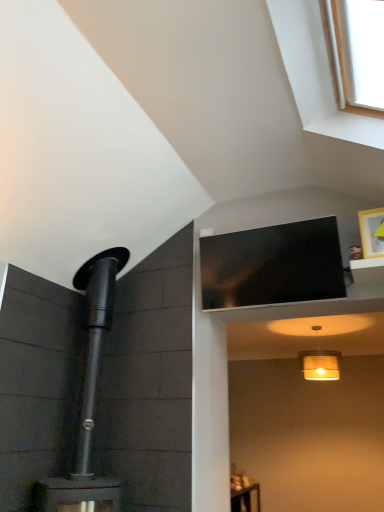
What do you see at coordinates (371, 232) in the screenshot?
I see `wooden picture frame at upper right` at bounding box center [371, 232].

This screenshot has width=384, height=512. In order to click on black glossy tv at upper center in this screenshot , I will do [x=272, y=265].

Locate an element on the screen. matte white lampshade at lower center is located at coordinates (320, 364).

Describe the element at coordinates (320, 364) in the screenshot. I see `matte white lampshade at lower center` at that location.

At what (x,y) coordinates should I click in order to perform the action: click on wooden picture frame at upper right. Please return your answer as a coordinate pair (x, y). The width and height of the screenshot is (384, 512). Looking at the image, I should click on tap(371, 232).

Locate an element on the screen. window located in front of the matte white lampshade at lower center is located at coordinates (317, 74).

Which of these two, matte white lampshade at lower center or white wood window at upper right, stands taller?

Standing taller between the two is white wood window at upper right.

From the image's perspective, which is above, matte white lampshade at lower center or white wood window at upper right?

white wood window at upper right, from the image's perspective.

Looking at their sizes, would you say matte white lampshade at lower center is wider or thinner than white wood window at upper right?

Considering their sizes, matte white lampshade at lower center looks slimmer than white wood window at upper right.

How far apart are black glossy tv at upper center and matte white lampshade at lower center?

black glossy tv at upper center and matte white lampshade at lower center are 1.66 meters apart from each other.

Looking at this image, is black glossy tv at upper center not near matte white lampshade at lower center?

Absolutely, black glossy tv at upper center is distant from matte white lampshade at lower center.

Considering the points (286, 287) and (298, 353), which point is in front, point (286, 287) or point (298, 353)?

The point (286, 287) is in front.

Is black glossy tv at upper center wider than matte white lampshade at lower center?

In fact, black glossy tv at upper center might be narrower than matte white lampshade at lower center.

Considering the positions of point (363, 245) and point (364, 124), is point (363, 245) closer or farther from the camera than point (364, 124)?

Point (363, 245).

Does wooden picture frame at upper right have a lesser height compared to white wood window at upper right?

Correct, wooden picture frame at upper right is not as tall as white wood window at upper right.

Is wooden picture frame at upper right directly adjacent to white wood window at upper right?

No, wooden picture frame at upper right is not making contact with white wood window at upper right.

From a real-world perspective, is wooden picture frame at upper right beneath white wood window at upper right?

Yes, from a real-world perspective, wooden picture frame at upper right is beneath white wood window at upper right.

Measure the distance from black glossy tv at upper center to wooden picture frame at upper right.

A distance of 20.78 inches exists between black glossy tv at upper center and wooden picture frame at upper right.

Between black glossy tv at upper center and wooden picture frame at upper right, which one has larger width?

black glossy tv at upper center is wider.

From the image's perspective, which one is positioned higher, black glossy tv at upper center or wooden picture frame at upper right?

wooden picture frame at upper right, from the image's perspective.

From the picture: Considering the relative sizes of black glossy tv at upper center and wooden picture frame at upper right in the image provided, is black glossy tv at upper center taller than wooden picture frame at upper right?

Yes, black glossy tv at upper center is taller than wooden picture frame at upper right.

Which is behind, matte white lampshade at lower center or black glossy tv at upper center?

matte white lampshade at lower center is more distant.

From the image's perspective, is matte white lampshade at lower center below black glossy tv at upper center?

Yes.

Looking at this image, in terms of width, does matte white lampshade at lower center look wider or thinner when compared to black glossy tv at upper center?

In the image, matte white lampshade at lower center appears to be wider than black glossy tv at upper center.

Considering the sizes of objects matte white lampshade at lower center and black glossy tv at upper center in the image provided, who is smaller, matte white lampshade at lower center or black glossy tv at upper center?

With smaller size is matte white lampshade at lower center.

You are a GUI agent. You are given a task and a screenshot of the screen. Output one action in this format:
    pyautogui.click(x=<x>, y=<y>)
    Task: Click on the window screen that appears below the white wood window at upper right (from the image's perspective)
    This screenshot has height=512, width=384.
    Given the screenshot: What is the action you would take?
    pyautogui.click(x=272, y=265)

Would you say white wood window at upper right is part of black glossy tv at upper center's contents?

No, white wood window at upper right is not surrounded by black glossy tv at upper center.

From the image's perspective, would you say black glossy tv at upper center is shown under white wood window at upper right?

Correct, black glossy tv at upper center appears lower than white wood window at upper right in the image.

Does black glossy tv at upper center have a greater height compared to white wood window at upper right?

No.

This screenshot has width=384, height=512. I want to click on picture frame lying in front of the matte white lampshade at lower center, so click(x=371, y=232).

From the image's perspective, is wooden picture frame at upper right located above or below matte white lampshade at lower center?

From the image's perspective, wooden picture frame at upper right appears above matte white lampshade at lower center.

How many degrees apart are the facing directions of wooden picture frame at upper right and matte white lampshade at lower center?

13.1 degrees separate the facing orientations of wooden picture frame at upper right and matte white lampshade at lower center.

Considering the relative sizes of wooden picture frame at upper right and matte white lampshade at lower center in the image provided, is wooden picture frame at upper right wider than matte white lampshade at lower center?

No, wooden picture frame at upper right is not wider than matte white lampshade at lower center.

Locate an element on the screen. The width and height of the screenshot is (384, 512). light fixture below the white wood window at upper right (from a real-world perspective) is located at coordinates (320, 364).

At what (x,y) coordinates should I click in order to perform the action: click on light fixture below the black glossy tv at upper center (from the image's perspective). Please return your answer as a coordinate pair (x, y). The height and width of the screenshot is (512, 384). Looking at the image, I should click on (320, 364).

Based on the photo, looking at the image, which one is located further to white wood window at upper right, matte white lampshade at lower center or black glossy tv at upper center?

Among the two, matte white lampshade at lower center is located further to white wood window at upper right.

Estimate the real-world distances between objects in this image. Which object is closer to wooden picture frame at upper right, white wood window at upper right or matte white lampshade at lower center?

The object closer to wooden picture frame at upper right is white wood window at upper right.

Looking at the image, which one is located further to wooden picture frame at upper right, white wood window at upper right or black glossy tv at upper center?

white wood window at upper right is further to wooden picture frame at upper right.

Which object lies further to the anchor point black glossy tv at upper center, wooden picture frame at upper right or white wood window at upper right?

white wood window at upper right is further to black glossy tv at upper center.

Looking at the image, which one is located further to black glossy tv at upper center, matte white lampshade at lower center or wooden picture frame at upper right?

Based on the image, matte white lampshade at lower center appears to be further to black glossy tv at upper center.

Based on their spatial positions, is white wood window at upper right or wooden picture frame at upper right further from black glossy tv at upper center?

white wood window at upper right is positioned further to the anchor black glossy tv at upper center.

Based on their spatial positions, is black glossy tv at upper center or wooden picture frame at upper right closer to white wood window at upper right?

wooden picture frame at upper right is positioned closer to the anchor white wood window at upper right.

When comparing their distances from matte white lampshade at lower center, does white wood window at upper right or black glossy tv at upper center seem further?

The object further to matte white lampshade at lower center is white wood window at upper right.

Identify the location of window screen between white wood window at upper right and matte white lampshade at lower center in the front-back direction. This screenshot has width=384, height=512. (272, 265).

Image resolution: width=384 pixels, height=512 pixels. Identify the location of picture frame between white wood window at upper right and matte white lampshade at lower center from front to back. (371, 232).

You are a GUI agent. You are given a task and a screenshot of the screen. Output one action in this format:
    pyautogui.click(x=<x>, y=<y>)
    Task: Click on the picture frame between white wood window at upper right and black glossy tv at upper center along the z-axis
    
    Given the screenshot: What is the action you would take?
    pyautogui.click(x=371, y=232)

Find the location of a particular element. The width and height of the screenshot is (384, 512). window screen positioned between wooden picture frame at upper right and matte white lampshade at lower center from near to far is located at coordinates (272, 265).